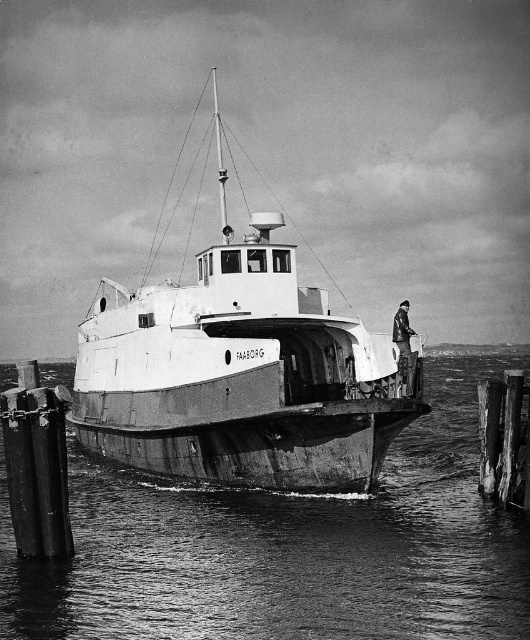
Can you confirm if smooth wood post at lower left is positioned below weathered wood post at lower right?

Incorrect, smooth wood post at lower left is not positioned below weathered wood post at lower right.

Which is in front, point (30, 465) or point (509, 387)?

Positioned in front is point (30, 465).

The width and height of the screenshot is (530, 640). Describe the element at coordinates (37, 472) in the screenshot. I see `smooth wood post at lower left` at that location.

The width and height of the screenshot is (530, 640). In order to click on smooth wood post at lower left in this screenshot , I will do `click(37, 472)`.

Who is lower down, smooth water at center or white matte boat at center?

Positioned lower is smooth water at center.

Does smooth water at center appear on the left side of white matte boat at center?

Incorrect, smooth water at center is not on the left side of white matte boat at center.

Is point (331, 593) more distant than point (325, 484)?

No, it is not.

At what (x,y) coordinates should I click in order to perform the action: click on smooth water at center. Please return your answer as a coordinate pair (x, y). The image size is (530, 640). Looking at the image, I should click on (288, 547).

Is point (304, 508) closer to viewer compared to point (54, 412)?

No, (304, 508) is behind (54, 412).

I want to click on smooth water at center, so click(x=288, y=547).